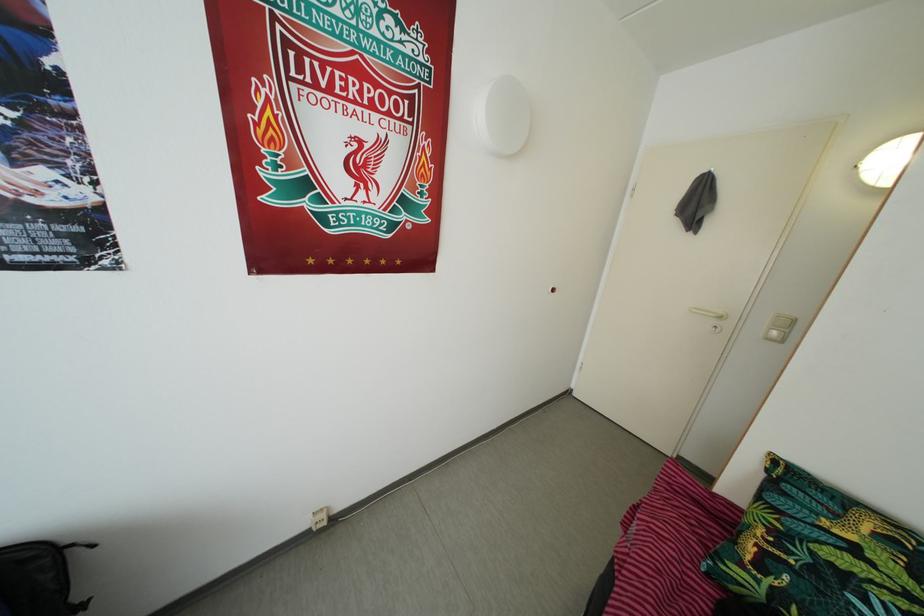
Locate an element on the screen. white power outlet is located at coordinates (320, 517).